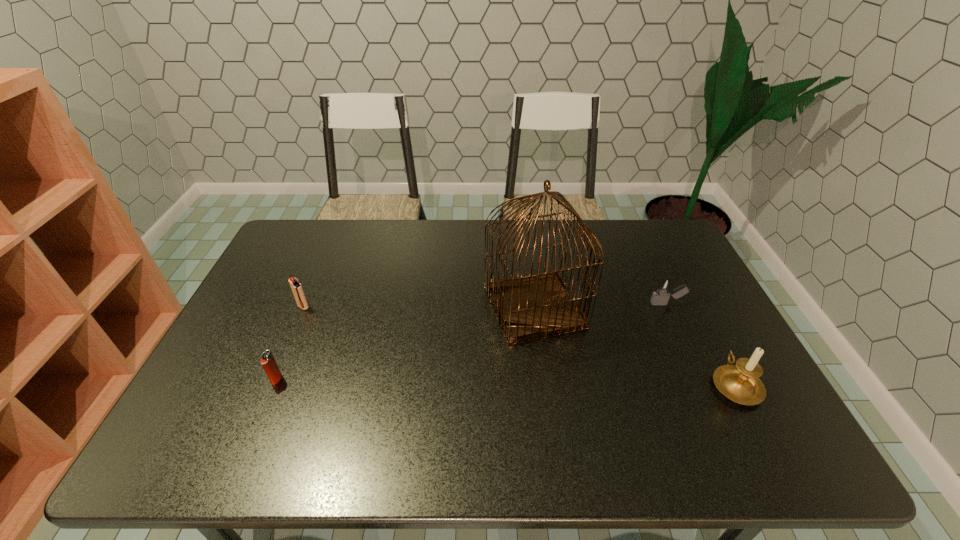
At what (x,y) coordinates should I click in order to perform the action: click on unoccupied area between the third object from right to left and the rightmost igniter. Please return your answer as a coordinate pair (x, y). This screenshot has width=960, height=540. Looking at the image, I should click on (601, 306).

The width and height of the screenshot is (960, 540). I want to click on free area in between the birdcage and the nearest igniter, so click(x=405, y=343).

Identify the location of object that stands as the fourth closest to the birdcage. The height and width of the screenshot is (540, 960). (268, 362).

Where is `object that is the third closest to the nearest igniter`? The height and width of the screenshot is (540, 960). object that is the third closest to the nearest igniter is located at coordinates (664, 286).

Point out which igniter is positioned as the second nearest to the candle holder. Please provide its 2D coordinates. Your answer should be formatted as a tuple, i.e. [(x, y)], where the tuple contains the x and y coordinates of a point satisfying the conditions above.

[(268, 362)]

Where is `igniter that is the closest to the rightmost igniter`? igniter that is the closest to the rightmost igniter is located at coordinates [x=298, y=292].

Where is `free space in the image that satisfies the following two spatial constraints: 1. on the back side of the rightmost igniter; 2. on the left side of the nearest igniter`? The image size is (960, 540). free space in the image that satisfies the following two spatial constraints: 1. on the back side of the rightmost igniter; 2. on the left side of the nearest igniter is located at coordinates (308, 304).